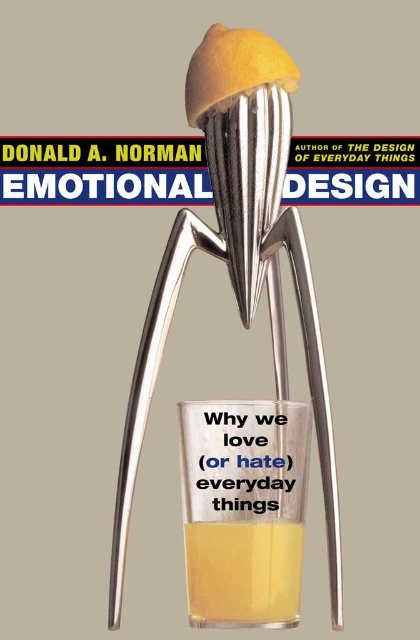
You are designing a display case for a kitchenware store. The case has a shelf that can only hold items wider than 10 inches. You have the polished metal juicer at center and the yellow translucent liquid at lower center. Which item can safely be placed on the shelf?

The polished metal juicer at center can be placed on the shelf because its width is larger than the yellow translucent liquid at lower center, meeting the minimum width requirement of 10 inches.

You are designing a virtual book cover and need to place a polished metal juicer at center. According to the description, where should you place it?

The polished metal juicer at center should be placed at point (x=273, y=355) as stated in the description.

You are looking at the book cover of Emotional Design. There are two points on the metallic citrus squeezer. One is at point (275, 292) and the other at point (273, 449). Which point is closer to you?

Point (275, 292) is further to the camera than point (273, 449), so the point closer to you is point (273, 449).